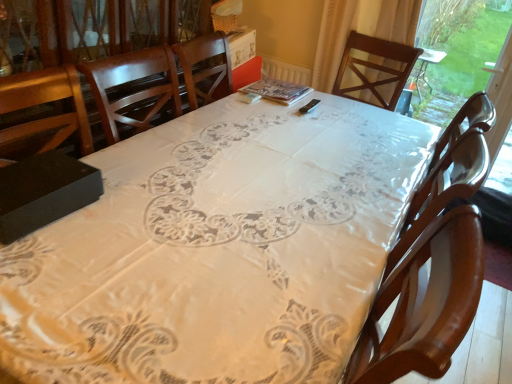
Question: Is white lace tablecloth at center bigger or smaller than black matte box at lower left?

Choices:
 (A) small
 (B) big

Answer: (B)

Question: Visually, is white lace tablecloth at center positioned to the left or to the right of black matte box at lower left?

Choices:
 (A) left
 (B) right

Answer: (B)

Question: Which is nearer to the white lace tablecloth at center?

Choices:
 (A) transparent plastic window screen at right
 (B) wooden chair at center
 (C) black matte box at lower left

Answer: (C)

Question: Based on their relative distances, which object is nearer to the white lace tablecloth at center?

Choices:
 (A) black matte box at lower left
 (B) transparent plastic window screen at right
 (C) wooden chair at center

Answer: (A)